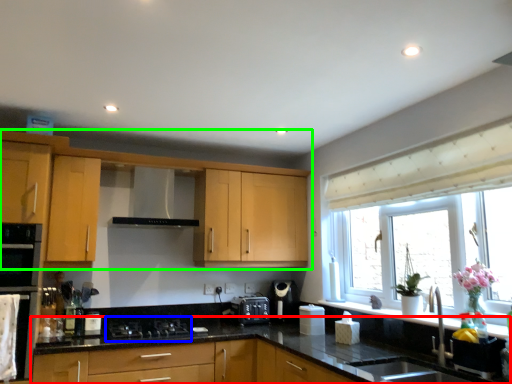
Question: Which object is the farthest from countertop (highlighted by a red box)? Choose among these: gas stove (highlighted by a blue box) or cabinetry (highlighted by a green box).

Choices:
 (A) gas stove
 (B) cabinetry

Answer: (B)